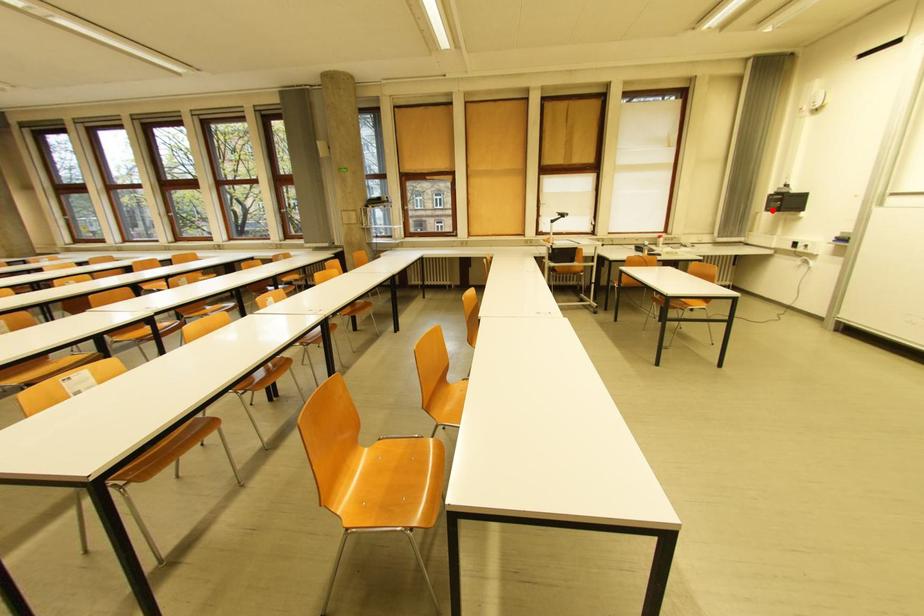
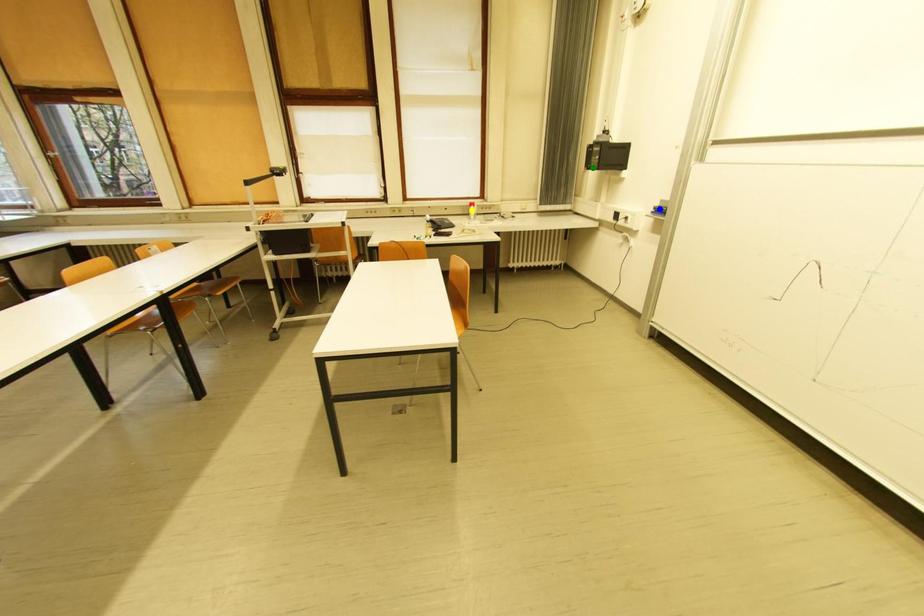
Question: I am providing you with two images of the same scene from different viewpoints. A red point is marked on the first image. You are given multiple points on the second image. Which point in image 2 is actually the same real-world point as the red point in image 1?

Choices:
 (A) green point
 (B) blue point
 (C) yellow point

Answer: (A)